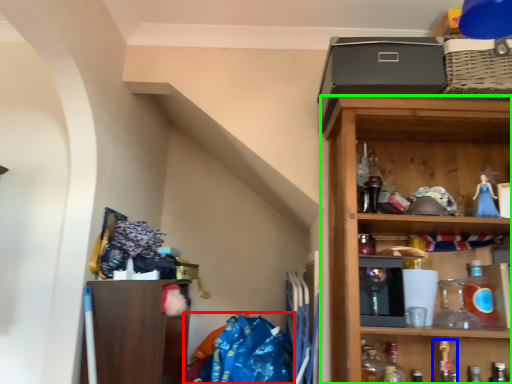
Question: Estimate the real-world distances between objects in this image. Which object is farther from material (highlighted by a red box), bottle (highlighted by a blue box) or shelf (highlighted by a green box)?

Choices:
 (A) bottle
 (B) shelf

Answer: (A)